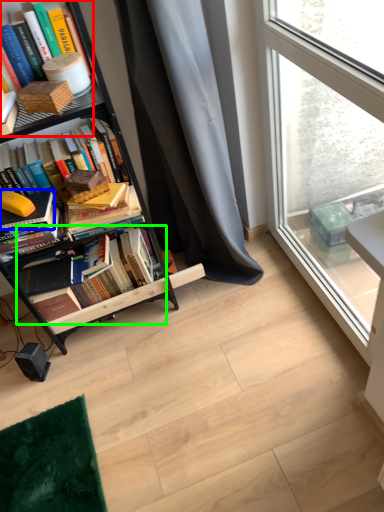
Question: Which object is positioned closest to book (highlighted by a red box)? Select from book (highlighted by a blue box) and book (highlighted by a green box).

Choices:
 (A) book
 (B) book

Answer: (A)